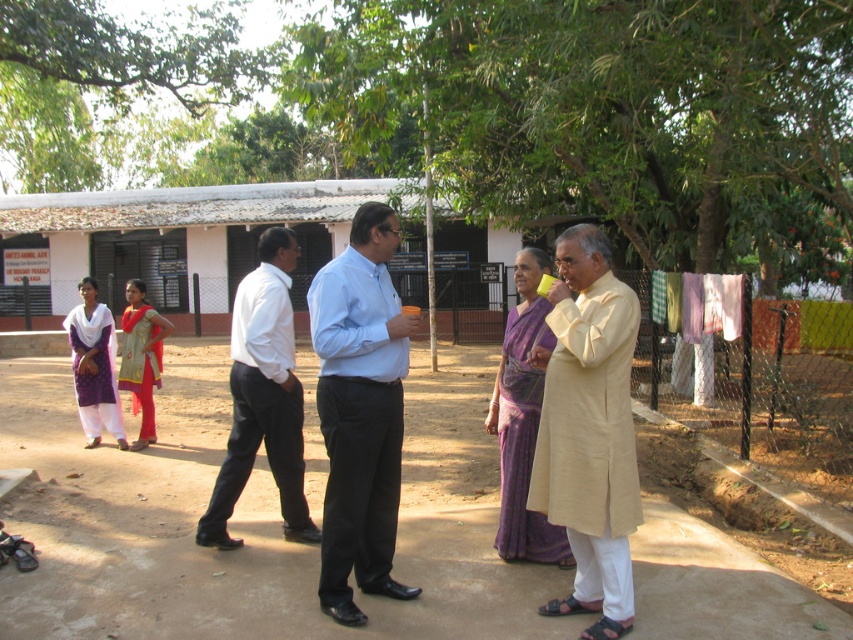
You are a photographer trying to capture a detailed shot of both the purple silk saree at center and the matte gold dress at center. Since both are at the center, which one should you adjust your camera angle to focus on first to ensure both are in frame?

The purple silk saree at center is to the right of the matte gold dress at center, so you should focus on the matte gold dress at center first, then adjust to include the purple silk saree at center to the right.

You are a photographer trying to capture a photo of the light blue shirt at center and the purple cotton dress at left. Since you want to ensure both subjects are in focus, which one should you focus on first to make sure the other is also in focus?

The light blue shirt at center is positioned over the purple cotton dress at left, so focusing on the light blue shirt at center first will ensure the purple cotton dress at left is also in focus because it is closer to the camera.